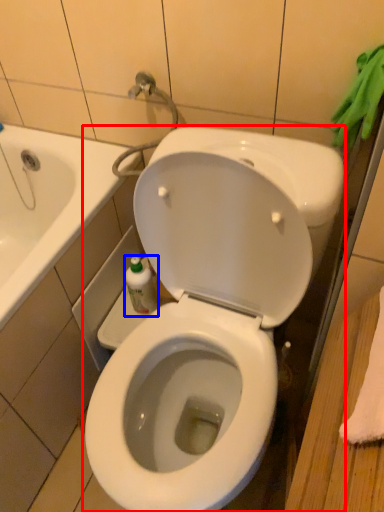
Question: Which object appears farthest to the camera in this image, toilet (highlighted by a red box) or bottle (highlighted by a blue box)?

Choices:
 (A) toilet
 (B) bottle

Answer: (B)